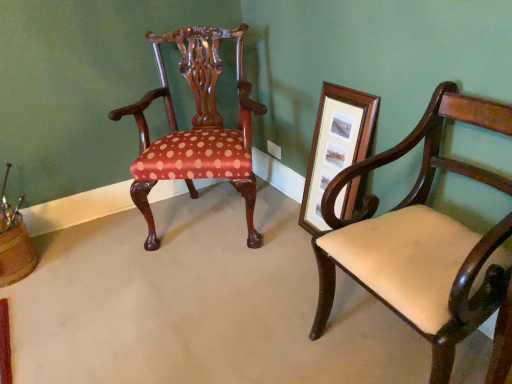
Locate an element on the screen. free space between polished wood chair at center, which is counted as the second chair, starting from the right, and matte cream upholstered chair at right, the first chair in the right-to-left sequence is located at coordinates (254, 278).